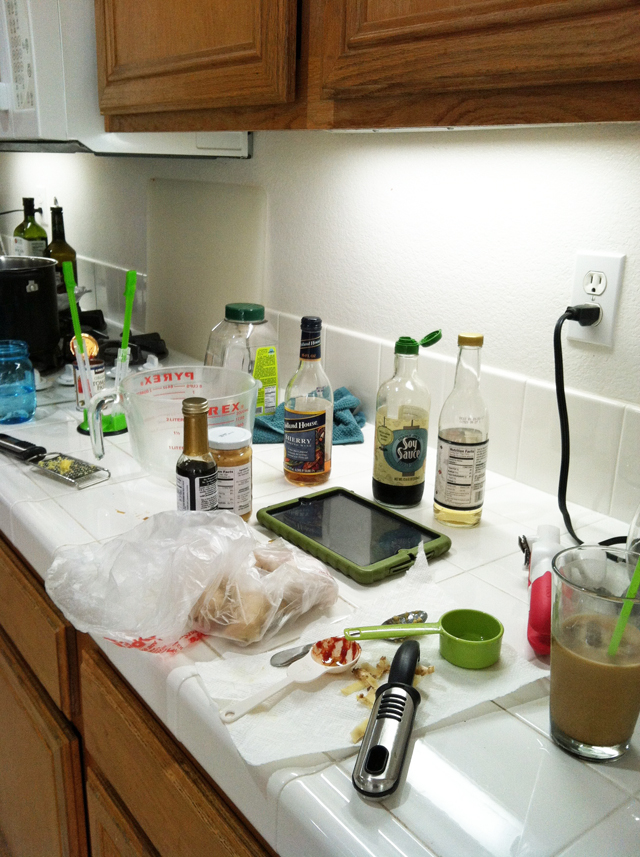
Image resolution: width=640 pixels, height=857 pixels. Find the location of `black pot`. black pot is located at coordinates (24, 289).